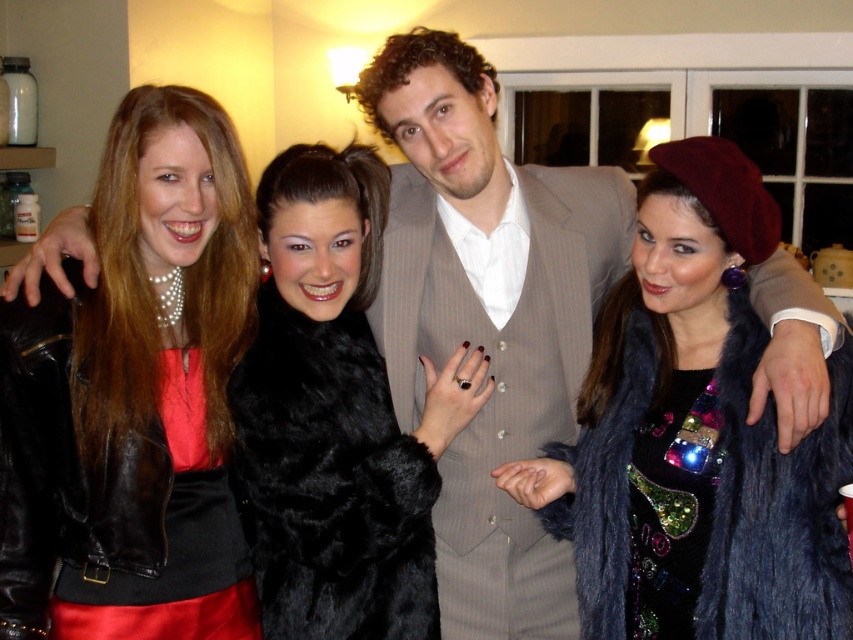
Question: Considering the real-world distances, which object is closest to the shiny black leather jacket at left?

Choices:
 (A) black fur coat at center
 (B) fuzzy dark blue fur coat at center

Answer: (A)

Question: Which of the following is the farthest from the observer?

Choices:
 (A) (306, 195)
 (B) (222, 406)

Answer: (A)

Question: Considering the real-world distances, which object is farthest from the fuzzy dark blue fur coat at center?

Choices:
 (A) shiny black leather jacket at left
 (B) black fur coat at center

Answer: (A)

Question: Can you confirm if fuzzy dark blue fur coat at center is smaller than black fur coat at center?

Choices:
 (A) no
 (B) yes

Answer: (A)

Question: Can you confirm if shiny black leather jacket at left is positioned to the right of black fur coat at center?

Choices:
 (A) no
 (B) yes

Answer: (A)

Question: Does shiny black leather jacket at left have a lesser width compared to black fur coat at center?

Choices:
 (A) yes
 (B) no

Answer: (A)